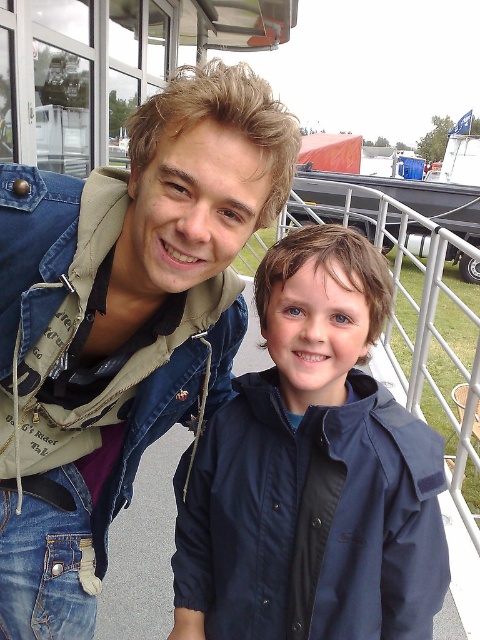
Question: Where is denim jacket at center located in relation to navy blue jacket at center in the image?

Choices:
 (A) right
 (B) left

Answer: (B)

Question: Is denim jacket at center wider than navy blue jacket at center?

Choices:
 (A) no
 (B) yes

Answer: (B)

Question: Which of the following is the closest to the observer?

Choices:
 (A) navy blue jacket at center
 (B) denim jacket at center

Answer: (B)

Question: Which of the following is the closest to the observer?

Choices:
 (A) denim jacket at center
 (B) navy blue jacket at center

Answer: (A)

Question: Can you confirm if denim jacket at center is bigger than navy blue jacket at center?

Choices:
 (A) no
 (B) yes

Answer: (B)